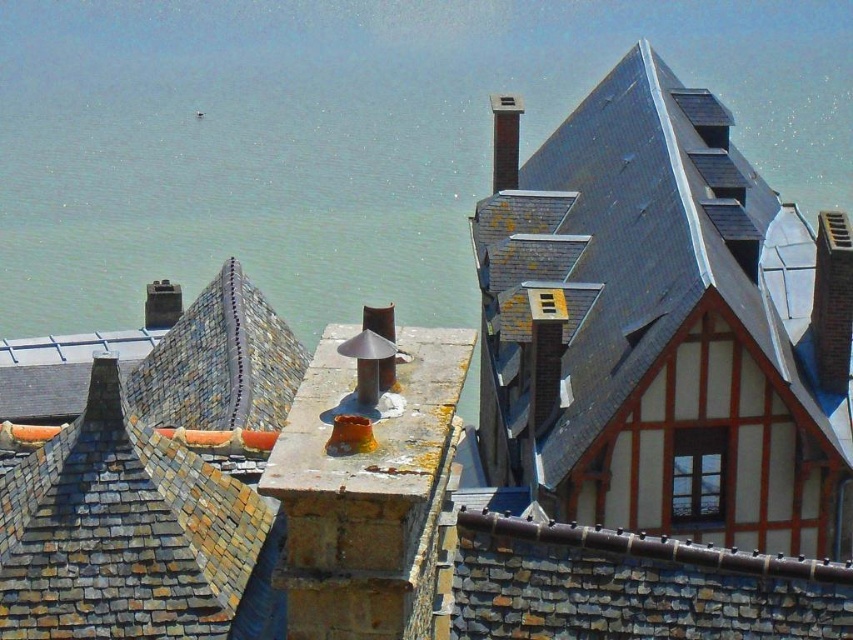
You are an architect analyzing the coastal town layout. You observe the shiny slate roof at upper right and the smooth silver chimney at upper center. Which object is located higher in the image?

The smooth silver chimney at upper center is higher in the image than the shiny slate roof at upper right because the shiny slate roof at upper right is positioned under it.

You are standing at the point marked by the coordinates point (631,262) in the coastal town image. Looking around, you see the shiny slate roof at upper right. Which direction should you face to see the shiny slate roof at upper right?

Since you are standing at the point marked by the coordinates point (631,262), which represents the shiny slate roof at upper right, you are already facing the shiny slate roof at upper right.

You are a drone operator tasked with capturing aerial footage of the coastal town. Your drone is currently positioned at coordinates point A. You need to fly it to the shiny slate roof at upper right, which is at point B. What is the direction you should fly the drone from point A to reach point B?

The shiny slate roof at upper right is located at point B, so you should fly the drone in the direction from point A towards point B to reach it.